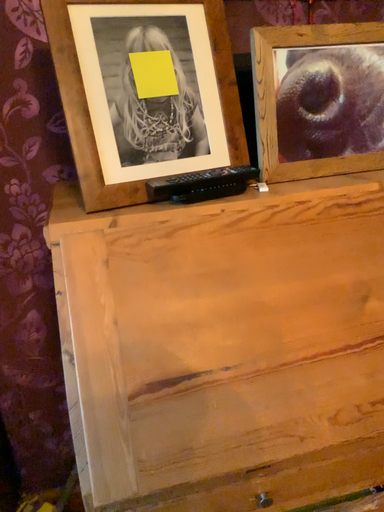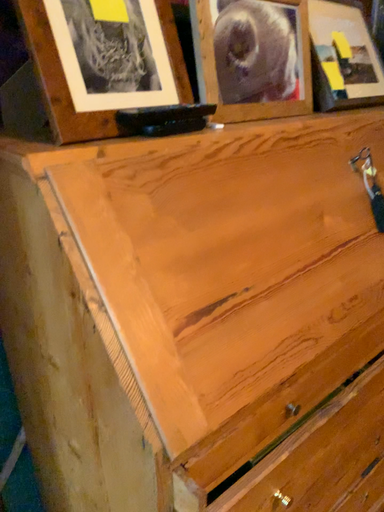
Question: How did the camera likely rotate when shooting the video?

Choices:
 (A) rotated right
 (B) rotated left

Answer: (A)